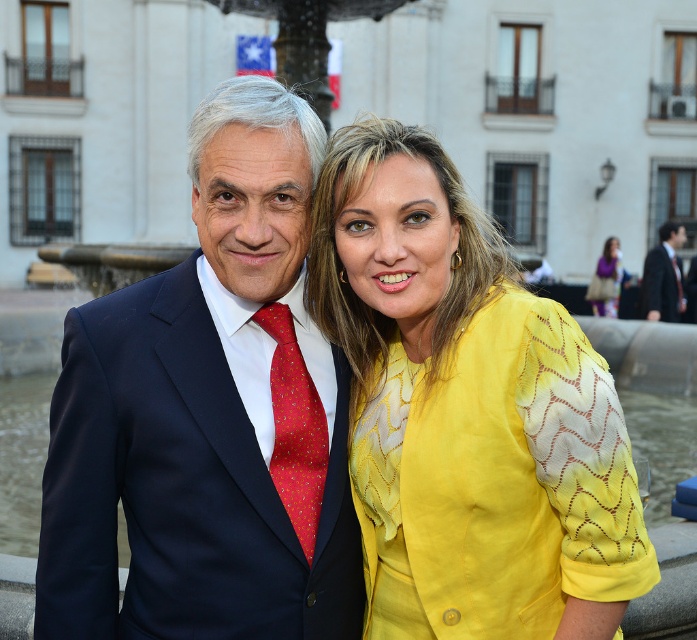
Question: Considering the real-world distances, which object is closest to the matte yellow dress at center?

Choices:
 (A) red silk tie at center
 (B) navy blue suit at center

Answer: (B)

Question: Among these objects, which one is farthest from the camera?

Choices:
 (A) red silk tie at center
 (B) matte yellow dress at center
 (C) navy blue suit at center

Answer: (B)

Question: Is red silk tie at center smaller than dark blue suit at right?

Choices:
 (A) no
 (B) yes

Answer: (B)

Question: Is dark blue suit at right to the right of matte yellow dress at center from the viewer's perspective?

Choices:
 (A) yes
 (B) no

Answer: (A)

Question: Which point appears farthest from the camera in this image?

Choices:
 (A) (606, 310)
 (B) (668, 248)
 (C) (339, 381)

Answer: (B)

Question: Is yellow textured blouse at center to the right of matte yellow dress at center from the viewer's perspective?

Choices:
 (A) no
 (B) yes

Answer: (A)